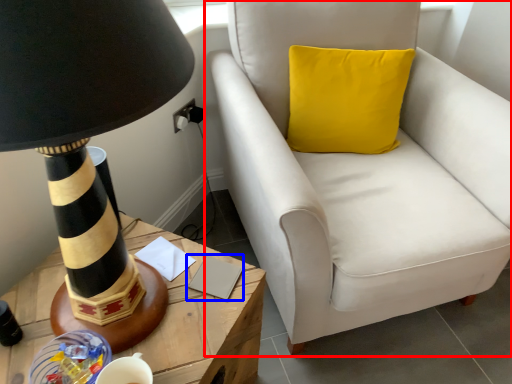
Question: Which object appears closest to the camera in this image, chair (highlighted by a red box) or notepad (highlighted by a blue box)?

Choices:
 (A) chair
 (B) notepad

Answer: (A)